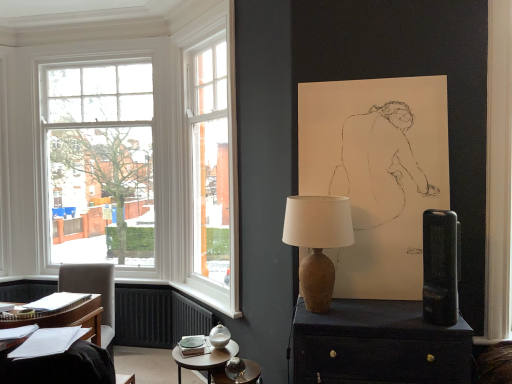
This screenshot has width=512, height=384. Identify the location of empty space that is in between black plastic speaker at right and brown ceramic lamp at center. (386, 322).